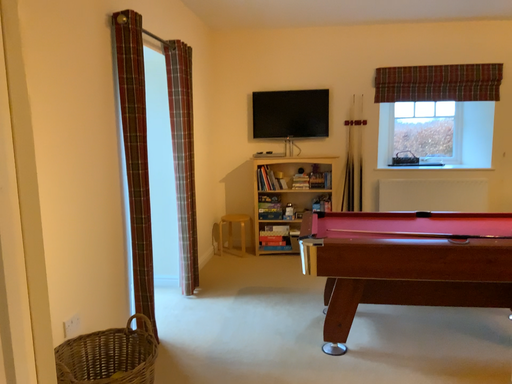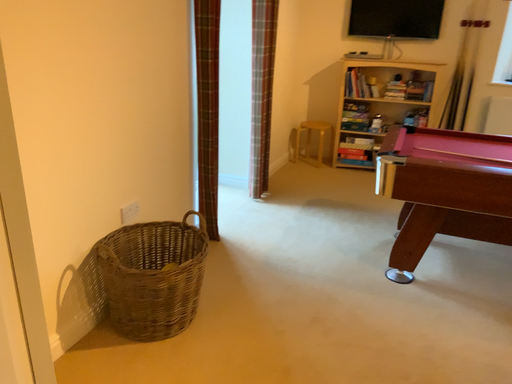
Question: How did the camera likely rotate when shooting the video?

Choices:
 (A) rotated downward
 (B) rotated upward

Answer: (A)